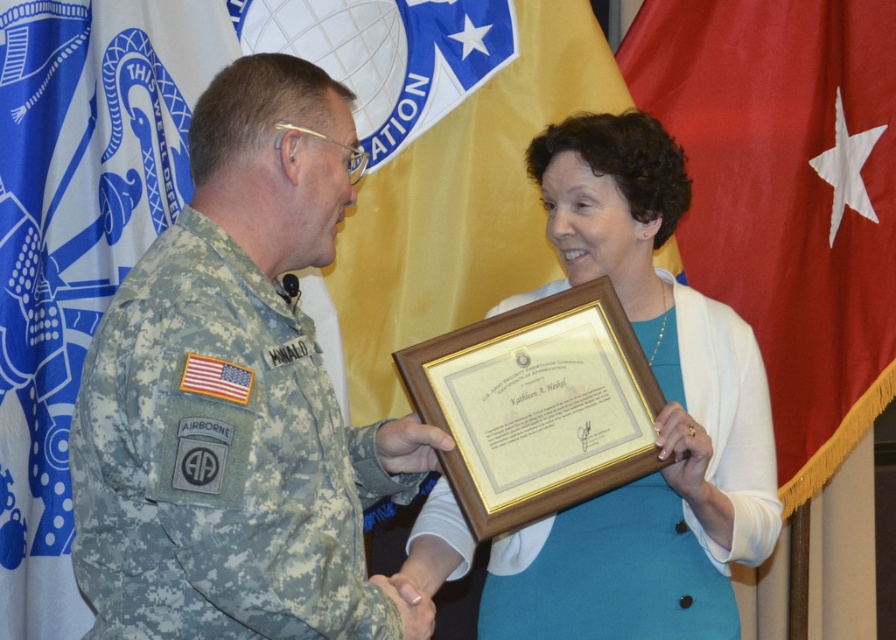
Question: Which point is farther from the camera taking this photo?

Choices:
 (A) (790, 358)
 (B) (154, 154)
 (C) (194, 513)

Answer: (A)

Question: Can you confirm if camouflage fabric uniform at left is positioned below blue fabric flag at left?

Choices:
 (A) yes
 (B) no

Answer: (A)

Question: Where is camouflage fabric uniform at left located in relation to wooden framed certificate at center in the image?

Choices:
 (A) below
 (B) above

Answer: (B)

Question: Which point is farther from the camera taking this photo?

Choices:
 (A) (116, 378)
 (B) (121, 125)
 (C) (731, 317)

Answer: (B)

Question: Is blue fabric flag at left below wooden framed certificate at center?

Choices:
 (A) no
 (B) yes

Answer: (A)

Question: Which of the following is the closest to the observer?

Choices:
 (A) red fabric flag at right
 (B) wooden framed certificate at center

Answer: (B)